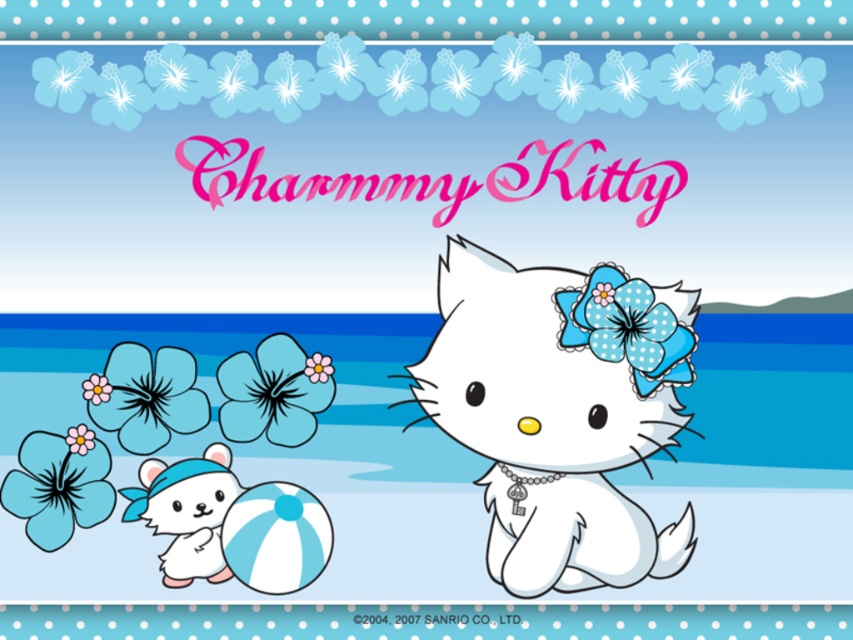
You are standing at the center of the image looking towards Charmmy Kitty. Which object is closer to your current position, the white plush bear at lower left or Charmmy Kitty?

The white plush bear at lower left is located at point (186, 512), while Charmmy Kitty is positioned at the foreground on the sand. Since the plush bear has coordinates closer to the lower left corner, it is farther away from your central position compared to Charmmy Kitty who is closer in the foreground. Therefore, Charmmy Kitty is closer to your current position.

You are organizing a beach picnic and have both the white plush bear at lower left and the pink fabric flower at center. If you want to place them on a small shelf that can only hold one item, which item should you choose based on their sizes?

The white plush bear at lower left is bigger than the pink fabric flower at center, so you should choose the pink fabric flower at center to place on the small shelf since it is smaller and more likely to fit.

You are a photographer setting up for a beach photo shoot. You want to capture both the white plush bear at lower left and the matte blue flower at upper left in the same frame. Which object should you adjust your camera focus on to ensure the background is blurred while keeping the other in focus?

You should focus on the white plush bear at lower left because the matte blue flower at upper left is behind it, so blurring the background will keep the bear in focus while the flower appears slightly out of focus.